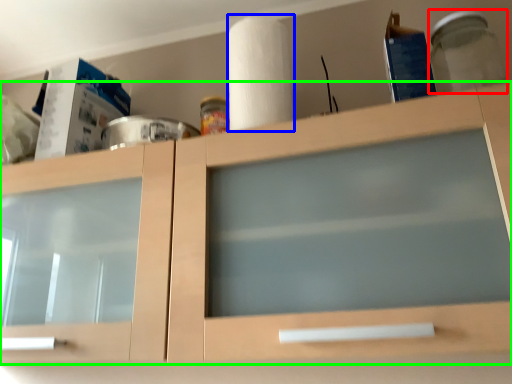
Question: Which object is the farthest from glass jar (highlighted by a red box)? Choose among these: paper towel (highlighted by a blue box) or cabinetry (highlighted by a green box).

Choices:
 (A) paper towel
 (B) cabinetry

Answer: (B)